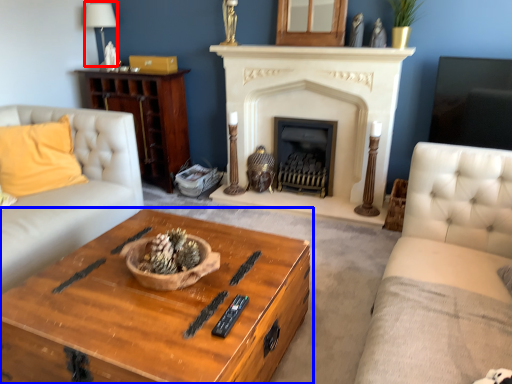
Question: Which object appears closest to the camera in this image, lamp (highlighted by a red box) or coffee table (highlighted by a blue box)?

Choices:
 (A) lamp
 (B) coffee table

Answer: (B)